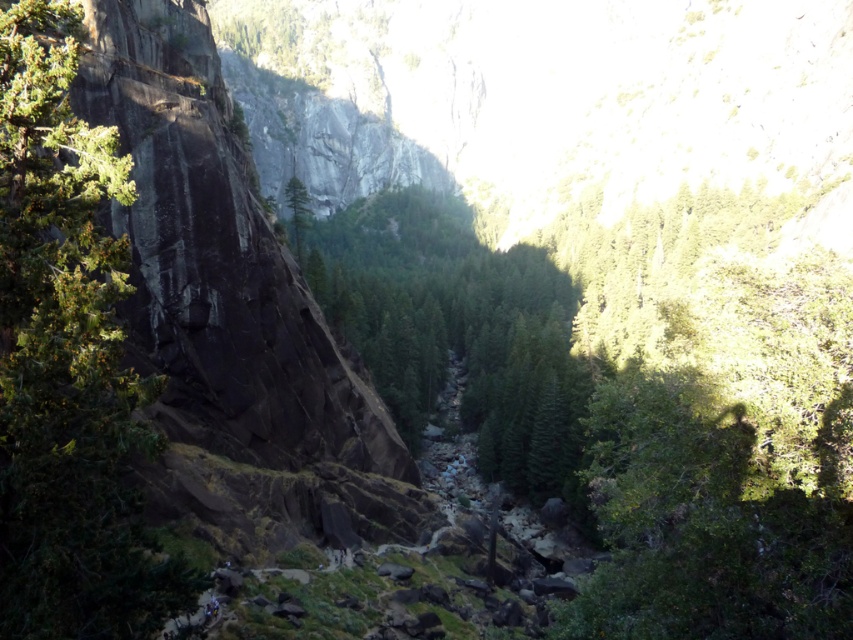
You are a hiker planning to cross the stream in the center of the valley. You have a map showing the green textured rock at left and the green textured tree at center. According to the map, how far apart are these two landmarks?

The distance between the green textured rock at left and the green textured tree at center is 81.95 meters.

You are standing at the center of the image and want to reach the green textured rock at left. Which direction should you move in to get there?

To reach the green textured rock at left, you should move to the left since it is located at the left side of the image.